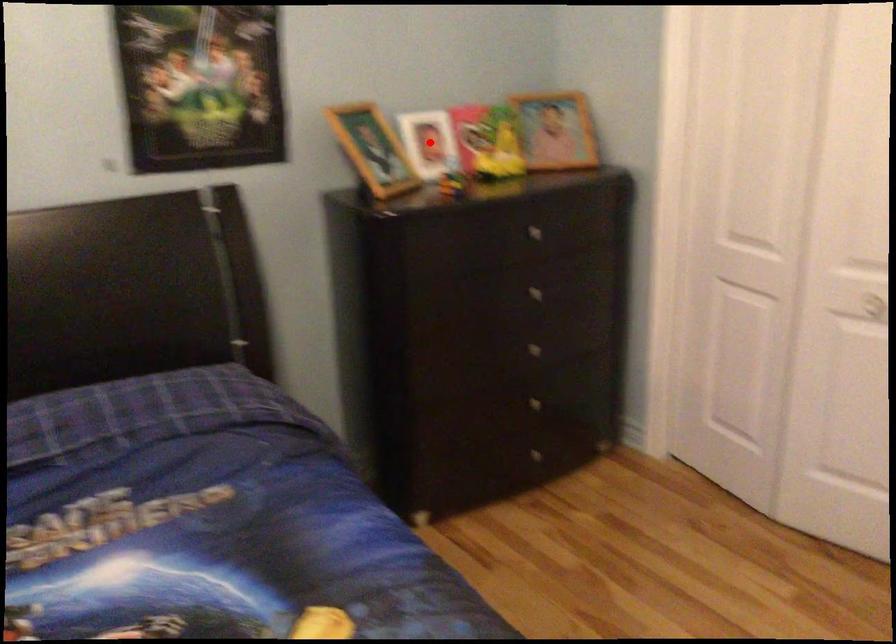
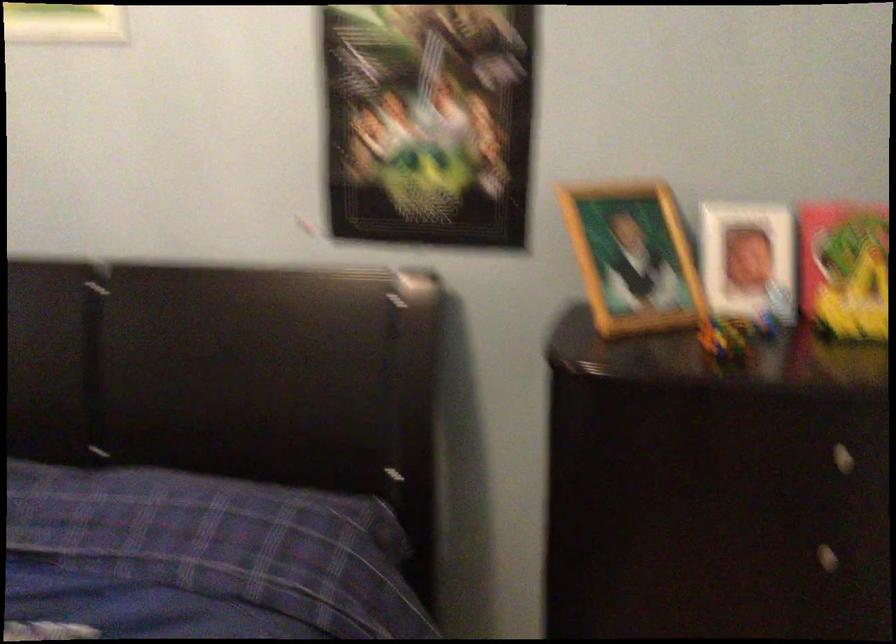
Question: I am providing you with two images of the same scene from different viewpoints. In image1, a red point is highlighted. Considering the same 3D point in image2, which of the following is correct?

Choices:
 (A) It is closer
 (B) It is farther

Answer: (A)